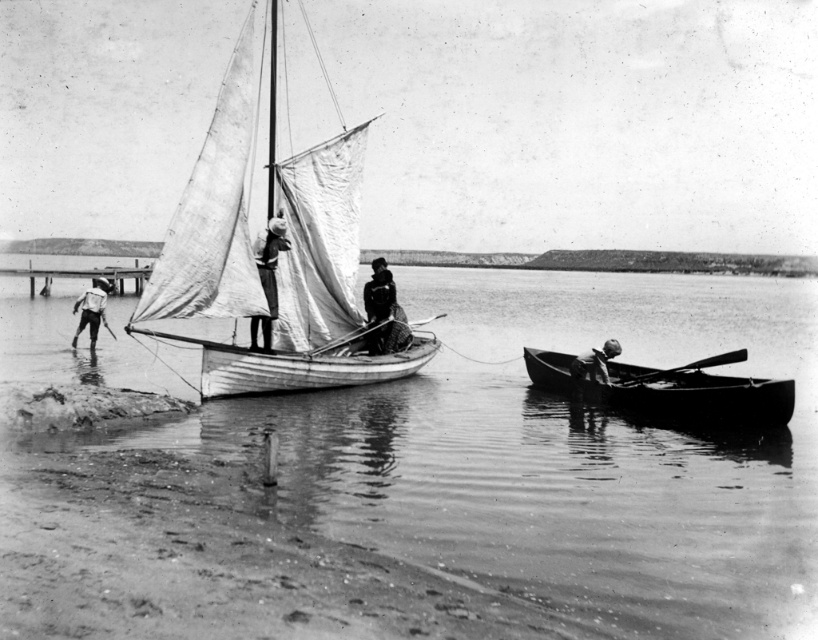
Can you confirm if wooden sailboat at center is bigger than white cloth sail at center?

Yes.

Does wooden sailboat at center appear on the right side of white cloth sail at center?

Incorrect, wooden sailboat at center is not on the right side of white cloth sail at center.

Describe the element at coordinates (272, 259) in the screenshot. I see `wooden sailboat at center` at that location.

Find the location of a particular element. The image size is (818, 640). wooden sailboat at center is located at coordinates (272, 259).

Does white cloth sail at center have a smaller size compared to smooth wooden paddle at lower right?

No.

Does white cloth sail at center have a lesser width compared to smooth wooden paddle at lower right?

Yes.

Does point (268, 276) lie in front of point (583, 372)?

Yes, point (268, 276) is closer to viewer.

I want to click on white cloth sail at center, so click(x=268, y=276).

Is dark fabric couple at center closer to camera compared to smooth wooden paddle at lower right?

That is False.

Between point (380, 332) and point (578, 378), which one is positioned in front?

Positioned in front is point (578, 378).

Image resolution: width=818 pixels, height=640 pixels. Identify the location of dark fabric couple at center. (381, 308).